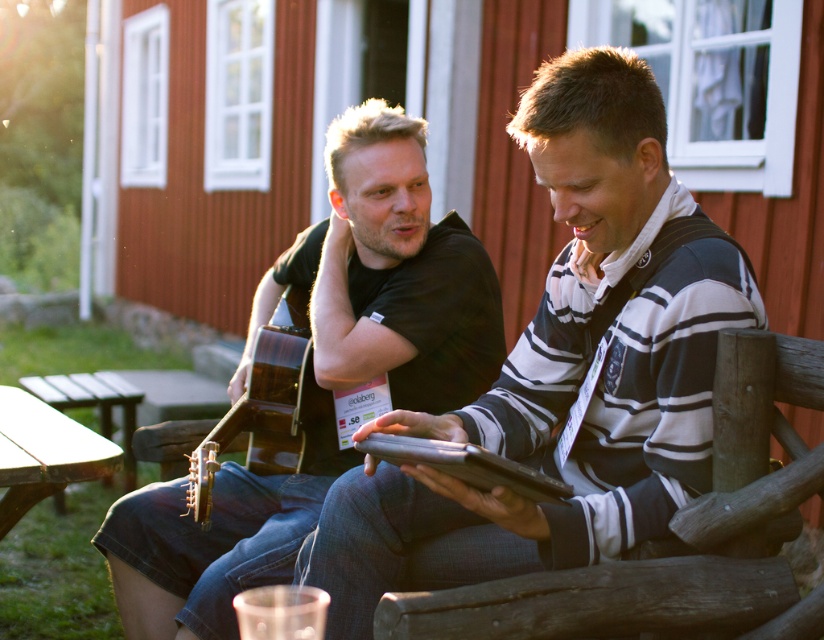
Based on the photo, you are organizing a small outdoor event and need to decide whether to place a large blanket on the wooden picnic table at lower left. Based on the size of the striped cotton sweater at center, which is also present at the event, can you determine if the blanket will fit on the table?

The striped cotton sweater at center has a larger size compared to wooden picnic table at lower left. Since the sweater is larger than the table, the blanket, which is presumably similar in size to the sweater, may not fit on the wooden picnic table at lower left.

You are standing at the origin point of the image. You see a striped cotton sweater at center located at point (563, 369). If you move 0.1 units to the right, will you be closer to the striped cotton sweater at center?

Moving 0.1 units to the right from the origin point would take you to 0.1, 0, which is further away from the striped cotton sweater at center located at (563, 369) compared to the original position. Therefore, you would not be closer.

You are organizing a picnic and need to place a striped cotton sweater on a surface. Based on the image, can you confirm if the striped cotton sweater at center can be placed on the wooden picnic table at lower left?

The striped cotton sweater at center is in front of the wooden picnic table at lower left, so it is not currently placed on the table. However, since the sweater is in front of the table, it could potentially be moved onto the table if there is enough space.